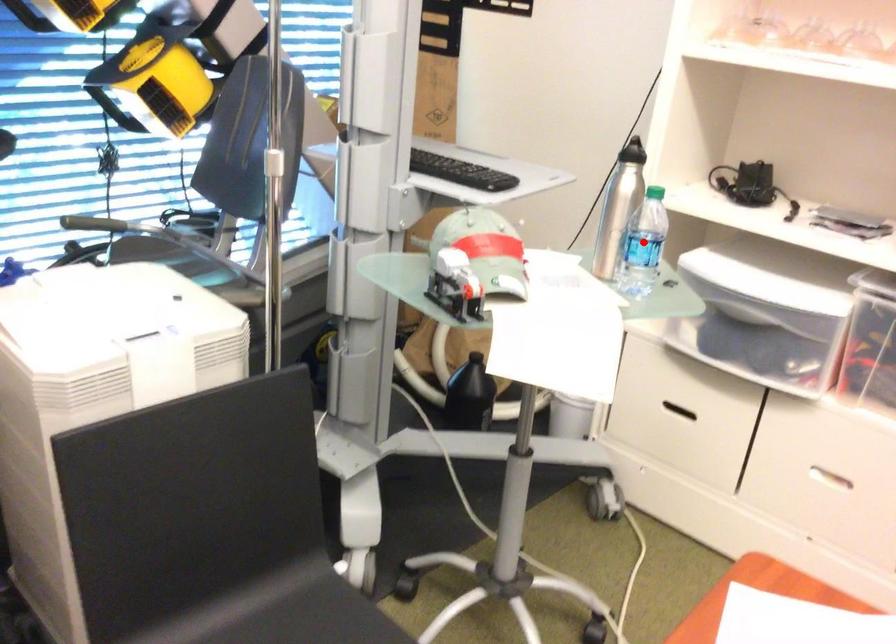
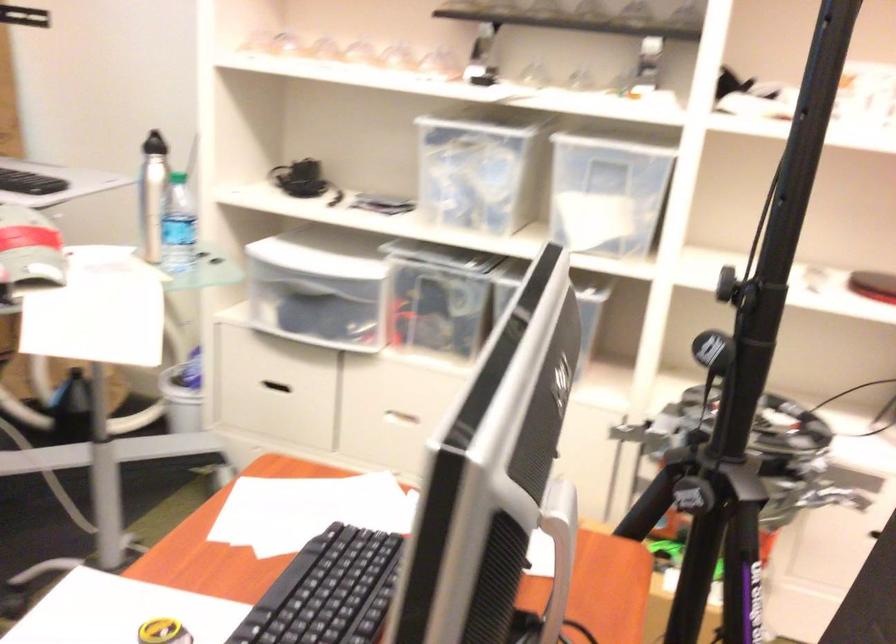
Question: A red point is marked in image1. In image2, is the corresponding 3D point closer to the camera or farther? Reply with the corresponding letter.

Choices:
 (A) The corresponding 3D point is closer.
 (B) The corresponding 3D point is farther.

Answer: (B)